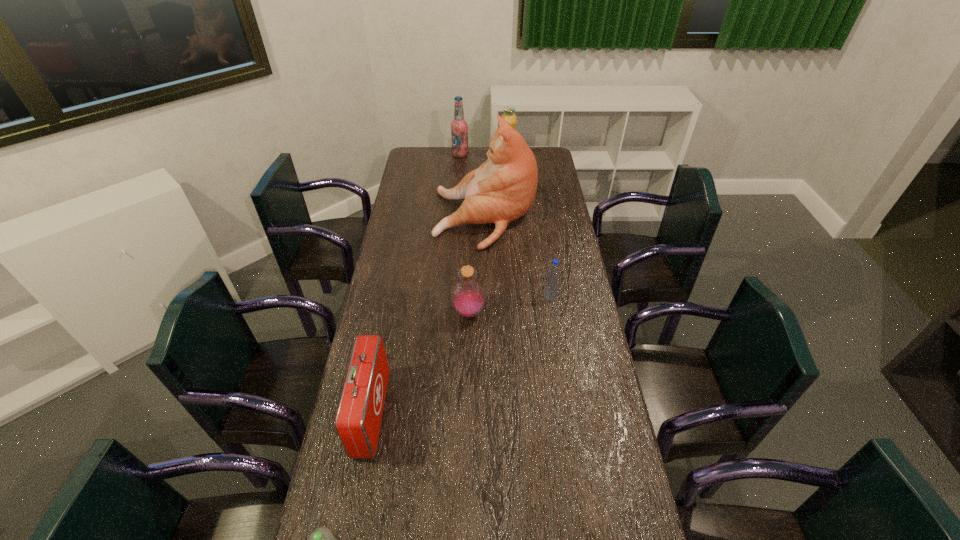
In the image, there is a desktop. In order to click on free space at the left edge in this screenshot , I will do `click(376, 295)`.

In the image, there is a desktop. Where is `blank space at the right edge`? blank space at the right edge is located at coordinates (582, 442).

In the image, there is a desktop. Identify the location of free region at the far left corner. (418, 161).

The width and height of the screenshot is (960, 540). Identify the location of vacant space at the far right corner of the desktop. (545, 165).

In order to click on free spot between the fruit juice and the first-aid kit in this screenshot , I will do `click(440, 287)`.

Where is `free space that is in between the bottle and the alcohol`? free space that is in between the bottle and the alcohol is located at coordinates (465, 234).

This screenshot has height=540, width=960. Find the location of `vacant point located between the sixth farthest object and the fifth nearest object`. vacant point located between the sixth farthest object and the fifth nearest object is located at coordinates (428, 316).

I want to click on empty location between the fifth nearest object and the farther water bottle, so click(517, 257).

At what (x,y) coordinates should I click in order to perform the action: click on vacant point located between the bottle and the fruit juice. Please return your answer as a coordinate pair (x, y). The width and height of the screenshot is (960, 540). Looking at the image, I should click on (488, 237).

What are the coordinates of `free space that is in between the first-aid kit and the bottle` in the screenshot? It's located at (420, 363).